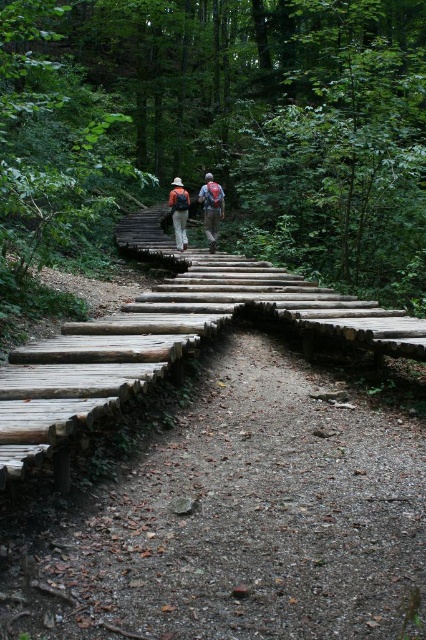
Does natural wood stairs at center have a lesser width compared to natural wood bridge at center?

No, natural wood stairs at center is not thinner than natural wood bridge at center.

Between point (55, 49) and point (210, 483), which one is positioned behind?

Point (55, 49)

In order to click on natural wood stairs at center in this screenshot , I will do `click(255, 115)`.

Is natural wood stairs at center to the right of matte brown backpacks at center from the viewer's perspective?

Yes, natural wood stairs at center is to the right of matte brown backpacks at center.

Does natural wood stairs at center have a greater height compared to matte brown backpacks at center?

Yes.

Does point (241, 35) lie in front of point (213, 225)?

No, (241, 35) is behind (213, 225).

Identify the location of natural wood stairs at center. This screenshot has width=426, height=640. (255, 115).

Is point (212, 564) positioned before point (215, 216)?

Yes, point (212, 564) is closer to viewer.

Does natural wood bridge at center appear over matte gray backpack at center?

No, natural wood bridge at center is not above matte gray backpack at center.

The height and width of the screenshot is (640, 426). What are the coordinates of `natural wood bridge at center` in the screenshot? It's located at (244, 516).